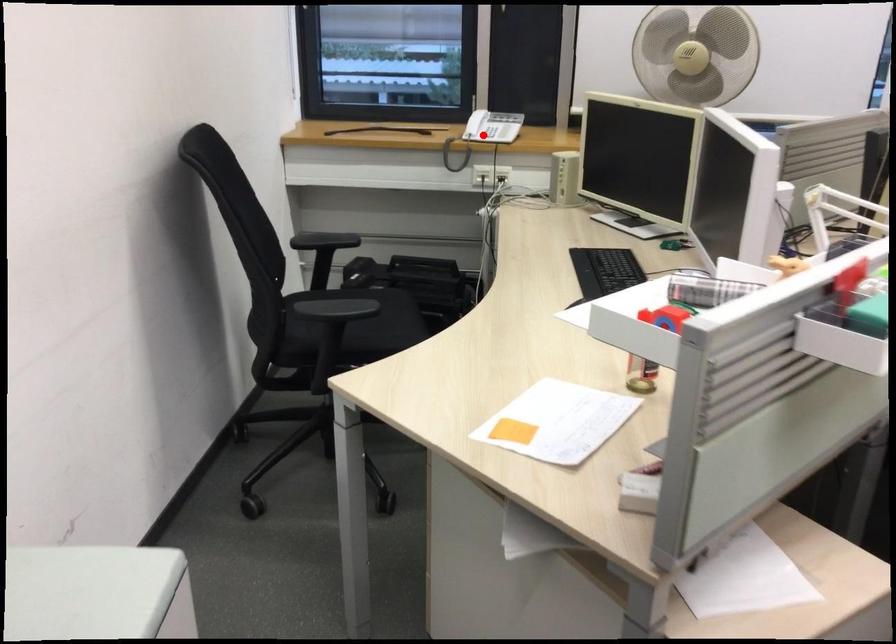
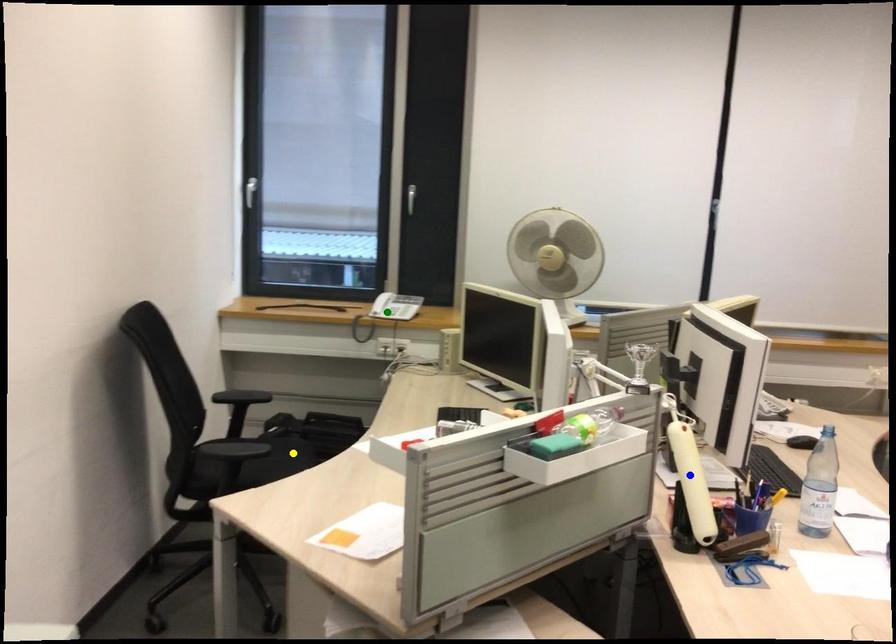
Question: I am providing you with two images of the same scene from different viewpoints. A red point is marked on the first image. You are given multiple points on the second image. Which point in image 2 is actually the same real-world point as the red point in image 1?

Choices:
 (A) green point
 (B) blue point
 (C) yellow point

Answer: (A)